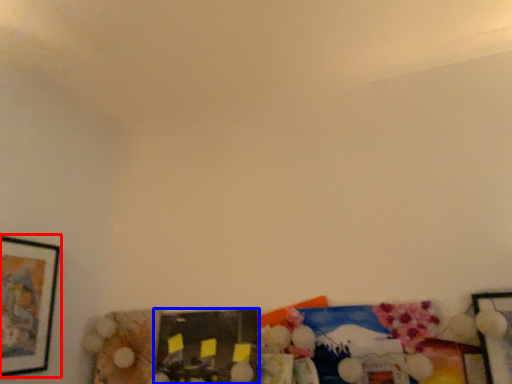
Question: Among these objects, which one is farthest to the camera, picture frame (highlighted by a red box) or picture frame (highlighted by a blue box)?

Choices:
 (A) picture frame
 (B) picture frame

Answer: (B)